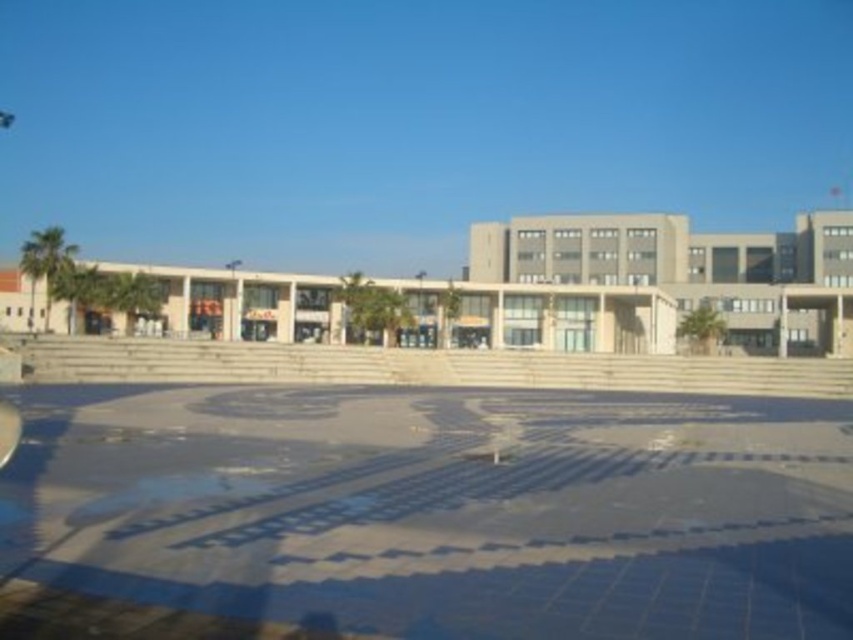
Between blue mosaic tiles at center and beige concrete plaza at center, which one is positioned lower?

blue mosaic tiles at center is below.

This screenshot has width=853, height=640. I want to click on blue mosaic tiles at center, so click(x=424, y=515).

The width and height of the screenshot is (853, 640). Find the location of `blue mosaic tiles at center`. blue mosaic tiles at center is located at coordinates (424, 515).